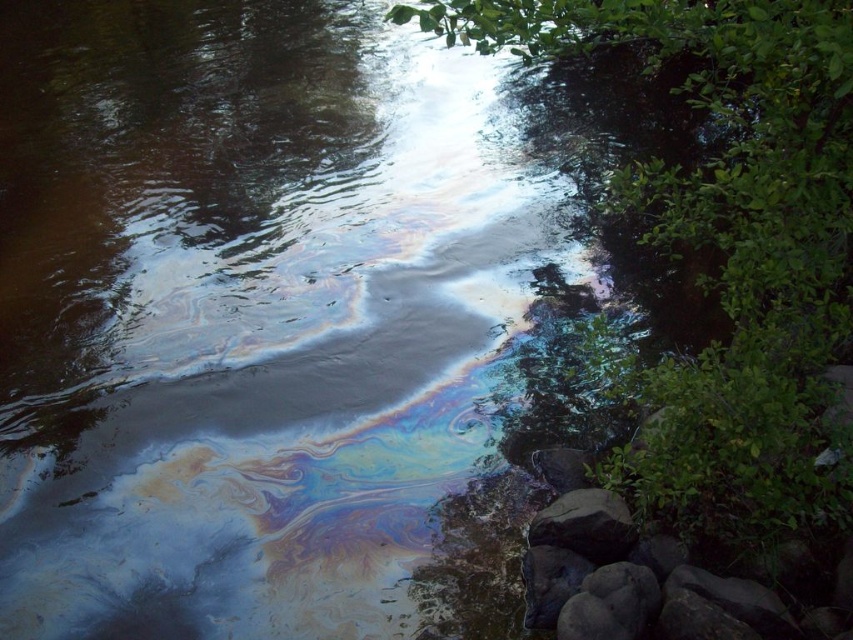
Question: Is green leafy tree at upper right closer to the viewer compared to smooth gray rock at lower right?

Choices:
 (A) no
 (B) yes

Answer: (B)

Question: Can you confirm if green leafy tree at upper right is positioned to the right of smooth gray rock at lower right?

Choices:
 (A) yes
 (B) no

Answer: (A)

Question: Considering the relative positions of green leafy tree at upper right and smooth gray rock at lower right in the image provided, where is green leafy tree at upper right located with respect to smooth gray rock at lower right?

Choices:
 (A) below
 (B) above

Answer: (B)

Question: Which point is closer to the camera?

Choices:
 (A) smooth gray rock at lower right
 (B) green leafy tree at upper right

Answer: (B)